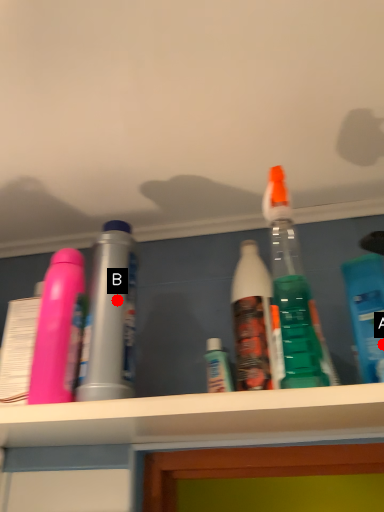
Question: Two points are circled on the image, labeled by A and B beside each circle. Among these points, which one is nearest to the camera?

Choices:
 (A) A is closer
 (B) B is closer

Answer: (B)